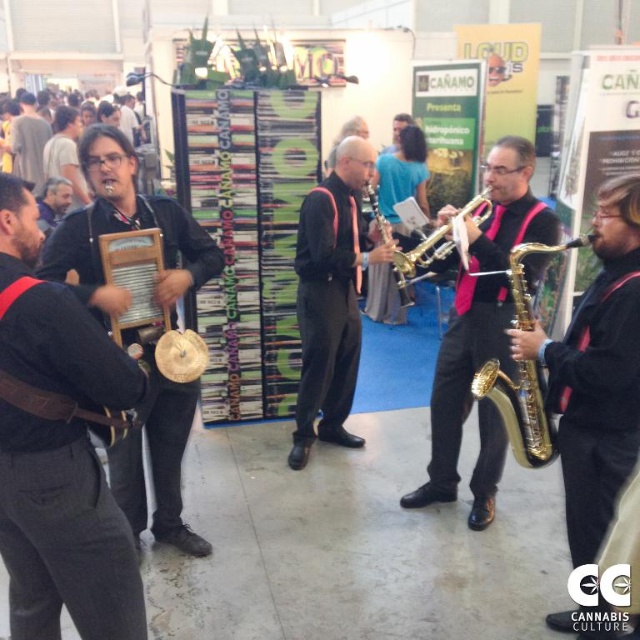
In the scene shown: You are a photographer at the event and want to capture a photo where both the gold shiny saxophone at right and the gold shiny saxophone at center are visible. Based on their positions, which saxophone would appear lower in the photo?

The gold shiny saxophone at right is positioned below the gold shiny saxophone at center, so it would appear lower in the photo.

You are a photographer at the event and want to capture both the gold shiny saxophone at center and the black matte saxophone at center in a single shot. Which saxophone is positioned lower in the frame?

The gold shiny saxophone at center is positioned lower than the black matte saxophone at center, so it will appear lower in the frame.